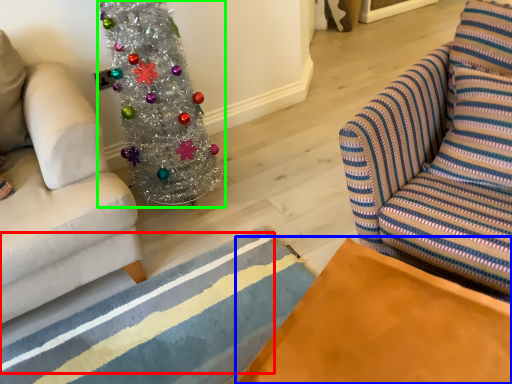
Question: Considering the real-world distances, which object is closest to stripe (highlighted by a red box)? table (highlighted by a blue box) or christmas tree (highlighted by a green box).

Choices:
 (A) table
 (B) christmas tree

Answer: (B)